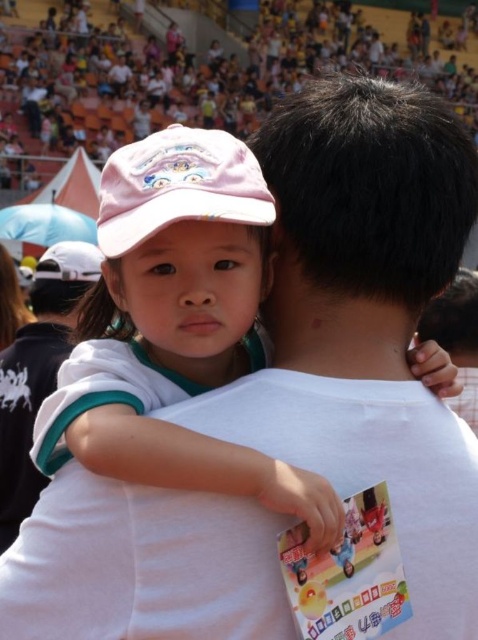
Who is positioned more to the right, pink fabric baseball cap at upper left or white cotton shirt at left?

Positioned to the right is pink fabric baseball cap at upper left.

Locate an element on the screen. pink fabric baseball cap at upper left is located at coordinates (178, 186).

What are the coordinates of `pink fabric baseball cap at upper left` in the screenshot? It's located at (178, 186).

In the scene shown: Is pink fabric baseball cap at upper left shorter than white matte baseball cap at upper left?

Yes.

Is pink fabric baseball cap at upper left to the left of white matte baseball cap at upper left from the viewer's perspective?

No, pink fabric baseball cap at upper left is not to the left of white matte baseball cap at upper left.

Image resolution: width=478 pixels, height=640 pixels. Describe the element at coordinates (178, 186) in the screenshot. I see `pink fabric baseball cap at upper left` at that location.

The width and height of the screenshot is (478, 640). Find the location of `pink fabric baseball cap at upper left`. pink fabric baseball cap at upper left is located at coordinates (178, 186).

Is white cotton shirt at left closer to camera compared to white matte baseball cap at upper left?

That is True.

Does white cotton shirt at left have a greater height compared to white matte baseball cap at upper left?

Indeed, white cotton shirt at left has a greater height compared to white matte baseball cap at upper left.

I want to click on white cotton shirt at left, so click(x=36, y=371).